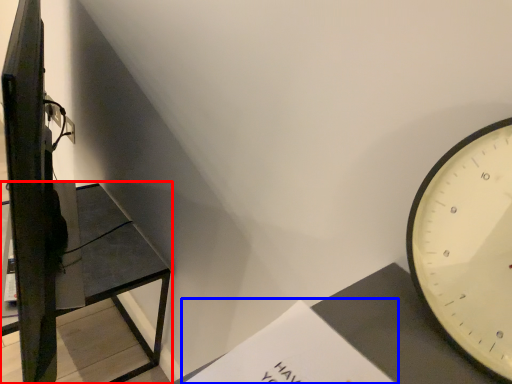
Question: Among these objects, which one is farthest to the camera, furniture (highlighted by a red box) or paperback book (highlighted by a blue box)?

Choices:
 (A) furniture
 (B) paperback book

Answer: (A)